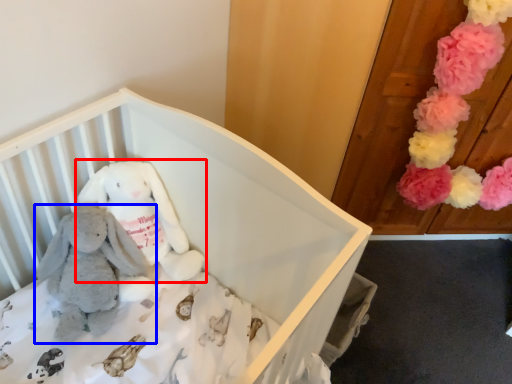
Question: Which point is further to the camera, toy (highlighted by a red box) or toy (highlighted by a blue box)?

Choices:
 (A) toy
 (B) toy

Answer: (A)